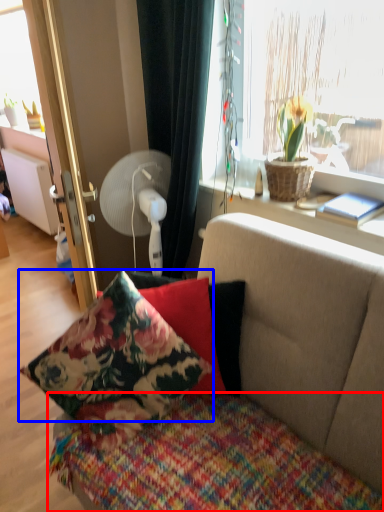
Question: Which of the following is the closest to the observer, bedcover (highlighted by a red box) or pillow (highlighted by a blue box)?

Choices:
 (A) bedcover
 (B) pillow

Answer: (A)